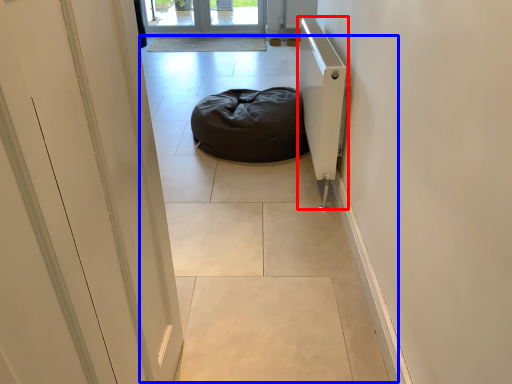
Question: Among these objects, which one is farthest to the camera, radiator (highlighted by a red box) or path (highlighted by a blue box)?

Choices:
 (A) radiator
 (B) path

Answer: (A)